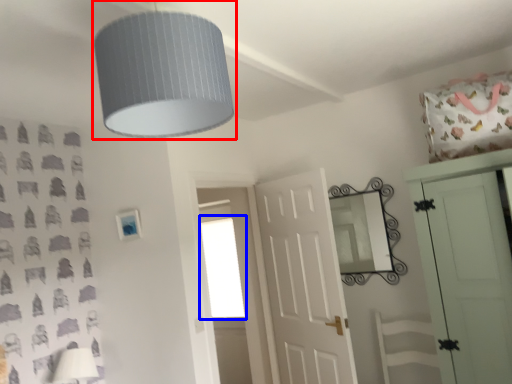
Question: Which object is further to the camera taking this photo, lamp (highlighted by a red box) or window (highlighted by a blue box)?

Choices:
 (A) lamp
 (B) window

Answer: (B)